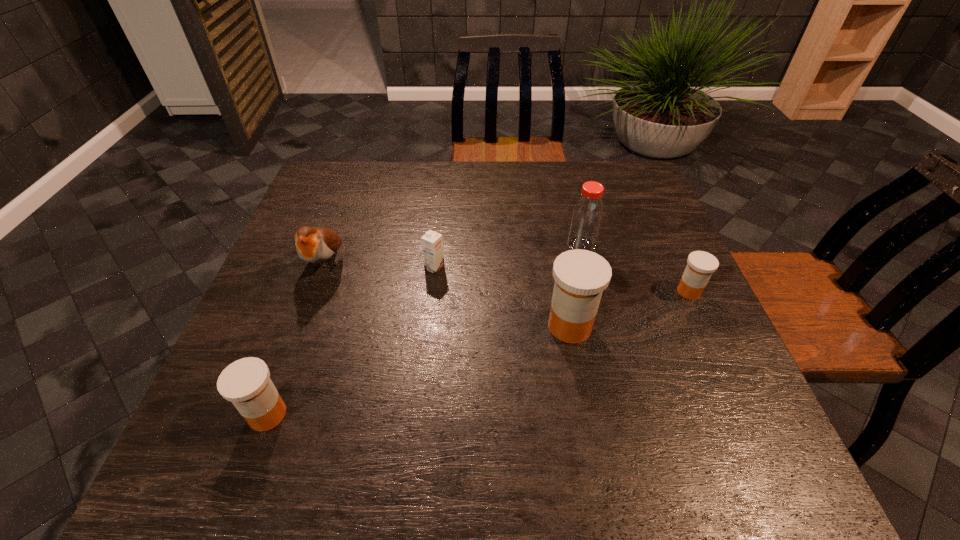
At what (x,y) coordinates should I click in order to perform the action: click on medicine that is the closest one to the nearest object. Please return your answer as a coordinate pair (x, y). Image resolution: width=960 pixels, height=540 pixels. Looking at the image, I should click on (581, 276).

Choose which medicine is the nearest neighbor to the second medicine from right to left. Please provide its 2D coordinates. Your answer should be formatted as a tuple, i.e. [(x, y)], where the tuple contains the x and y coordinates of a point satisfying the conditions above.

[(701, 265)]

In order to click on free region that satisfies the following two spatial constraints: 1. on the label of the rightmost object; 2. on the label of the nearest object in this screenshot , I will do `click(745, 414)`.